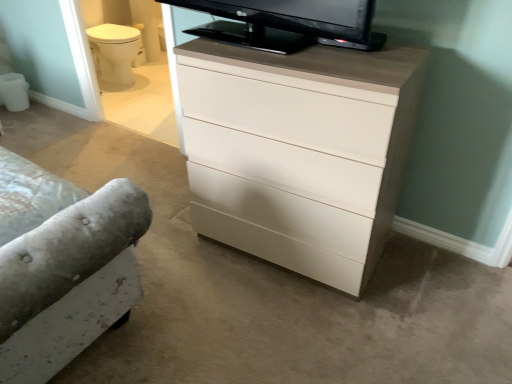
This screenshot has width=512, height=384. Describe the element at coordinates (298, 152) in the screenshot. I see `white glossy chest of drawers at center` at that location.

Where is `white glossy chest of drawers at center`? white glossy chest of drawers at center is located at coordinates (298, 152).

What do you see at coordinates (281, 212) in the screenshot? This screenshot has width=512, height=384. I see `white matte drawer at center` at bounding box center [281, 212].

Where is `white matte drawer at center`? white matte drawer at center is located at coordinates (281, 212).

In order to face white matte drawer at center, should I rotate leftwards or rightwards?

Turn right approximately 7.495 degrees to face it.

You are a GUI agent. You are given a task and a screenshot of the screen. Output one action in this format:
    pyautogui.click(x=<x>, y=<y>)
    Task: Click on the white glossy chest of drawers at center
    This screenshot has width=512, height=384.
    Given the screenshot: What is the action you would take?
    (x=298, y=152)

Does white glossy chest of drawers at center appear on the left side of white matte drawer at center?

Yes.

From the picture: Which object is closer to the camera taking this photo, white glossy chest of drawers at center or white matte drawer at center?

white glossy chest of drawers at center is in front.

Is point (186, 101) closer or farther from the camera than point (286, 228)?

Point (186, 101) is positioned closer to the camera compared to point (286, 228).

From the image's perspective, is white glossy chest of drawers at center located beneath white matte drawer at center?

Incorrect, from the image's perspective, white glossy chest of drawers at center is higher than white matte drawer at center.

From a real-world perspective, is white glossy chest of drawers at center positioned under white matte drawer at center based on gravity?

No, from a real-world perspective, white glossy chest of drawers at center is not under white matte drawer at center.

In terms of width, does white glossy chest of drawers at center look wider or thinner when compared to white matte drawer at center?

Clearly, white glossy chest of drawers at center has more width compared to white matte drawer at center.

Who is shorter, white glossy chest of drawers at center or white matte drawer at center?

white matte drawer at center is shorter.

Considering the relative sizes of white glossy chest of drawers at center and white matte drawer at center in the image provided, is white glossy chest of drawers at center bigger than white matte drawer at center?

Indeed, white glossy chest of drawers at center has a larger size compared to white matte drawer at center.

Based on the photo, is white glossy chest of drawers at center positioned beyond the bounds of white matte drawer at center?

Yes, white glossy chest of drawers at center is outside of white matte drawer at center.

Is white glossy chest of drawers at center in contact with white matte drawer at center?

No, white glossy chest of drawers at center is not with white matte drawer at center.

Is white glossy chest of drawers at center turned away from white matte drawer at center?

Yes, white matte drawer at center is at the back of white glossy chest of drawers at center.

Can you tell me how much white glossy chest of drawers at center and white matte drawer at center differ in facing direction?

They differ by 2.46 degrees in their facing directions.

Looking at this image, measure the distance between white glossy chest of drawers at center and white matte drawer at center.

5.76 inches.

Where is `drawer below the white glossy chest of drawers at center (from the image's perspective)`? drawer below the white glossy chest of drawers at center (from the image's perspective) is located at coordinates (281, 212).

Is white matte drawer at center at the left side of white glossy chest of drawers at center?

No.

Considering the relative positions of white matte drawer at center and white glossy chest of drawers at center in the image provided, is white matte drawer at center behind white glossy chest of drawers at center?

That is True.

Does point (276, 198) lie behind point (312, 156)?

Yes, it is behind point (312, 156).

From the image's perspective, is white matte drawer at center positioned above or below white glossy chest of drawers at center?

Based on their image positions, white matte drawer at center is located beneath white glossy chest of drawers at center.

From a real-world perspective, which is physically below, white matte drawer at center or white glossy chest of drawers at center?

white matte drawer at center.

Which object is wider, white matte drawer at center or white glossy chest of drawers at center?

Wider between the two is white glossy chest of drawers at center.

Which of these two, white matte drawer at center or white glossy chest of drawers at center, stands taller?

white glossy chest of drawers at center.

Considering the relative sizes of white matte drawer at center and white glossy chest of drawers at center in the image provided, is white matte drawer at center smaller than white glossy chest of drawers at center?

Yes.

Is white matte drawer at center outside of white glossy chest of drawers at center?

Yes, white matte drawer at center is outside of white glossy chest of drawers at center.

Does white matte drawer at center touch white glossy chest of drawers at center?

No.

Is white matte drawer at center oriented away from white glossy chest of drawers at center?

white matte drawer at center does not have its back to white glossy chest of drawers at center.

What's the angular difference between white matte drawer at center and white glossy chest of drawers at center's facing directions?

2.46 degrees separate the facing orientations of white matte drawer at center and white glossy chest of drawers at center.

Image resolution: width=512 pixels, height=384 pixels. Identify the location of drawer that appears behind the white glossy chest of drawers at center. (281, 212).

Locate an element on the screen. This screenshot has width=512, height=384. drawer on the right of white glossy chest of drawers at center is located at coordinates (281, 212).

Locate an element on the screen. Image resolution: width=512 pixels, height=384 pixels. chest of drawers on the left of white matte drawer at center is located at coordinates (298, 152).